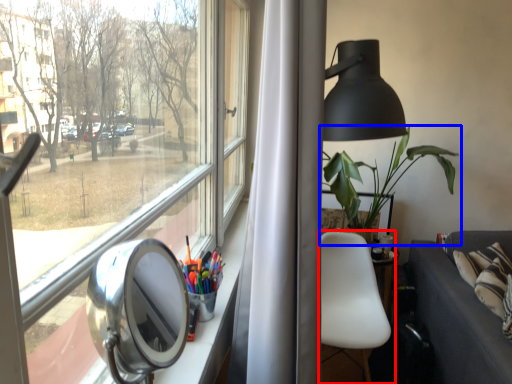
Question: Among these objects, which one is nearest to the camera, chair (highlighted by a red box) or houseplant (highlighted by a blue box)?

Choices:
 (A) chair
 (B) houseplant

Answer: (A)